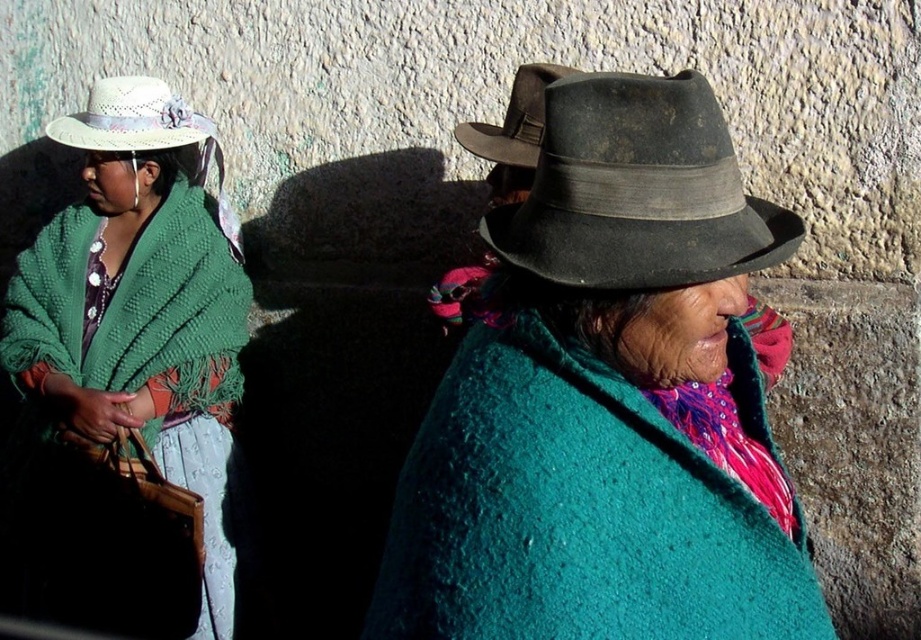
Is point (414, 484) farther from viewer compared to point (521, 163)?

No, (414, 484) is in front of (521, 163).

Where is `teal woolen shawl at center`? teal woolen shawl at center is located at coordinates (608, 401).

Can you confirm if matte green shawl at left is shorter than white straw hat at upper left?

Incorrect, matte green shawl at left's height does not fall short of white straw hat at upper left's.

Identify the location of matte green shawl at left. Image resolution: width=921 pixels, height=640 pixels. (127, 380).

Is white straw hat at upper left wider than dark brown felt cowboy hat at upper right?

Yes, white straw hat at upper left is wider than dark brown felt cowboy hat at upper right.

Is white straw hat at upper left smaller than dark brown felt cowboy hat at upper right?

No.

At what (x,y) coordinates should I click in order to perform the action: click on white straw hat at upper left. Please return your answer as a coordinate pair (x, y). This screenshot has height=640, width=921. Looking at the image, I should click on (132, 118).